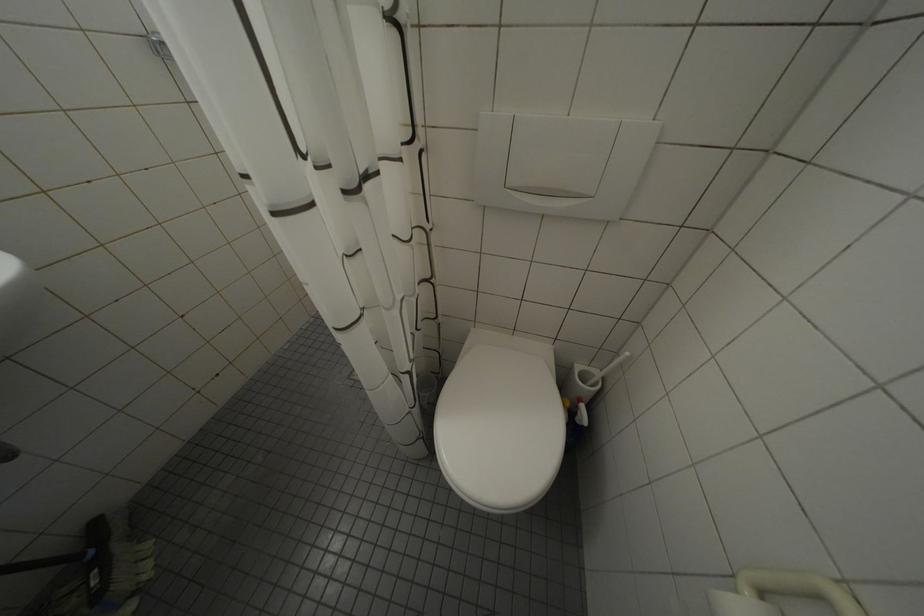
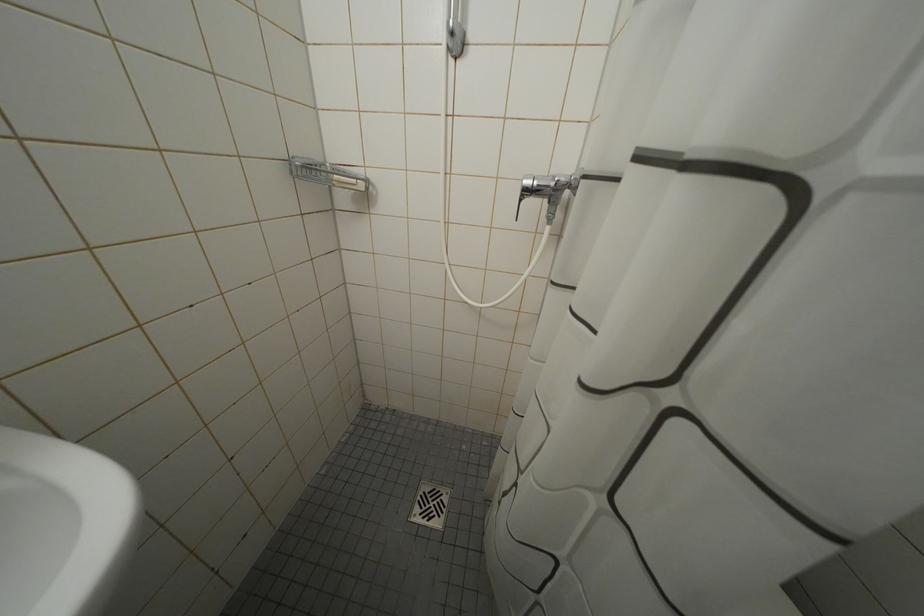
Question: Based on the continuous images, in which direction is the camera rotating? Reply with the corresponding letter.

Choices:
 (A) Left
 (B) Right
 (C) Up
 (D) Down

Answer: (C)